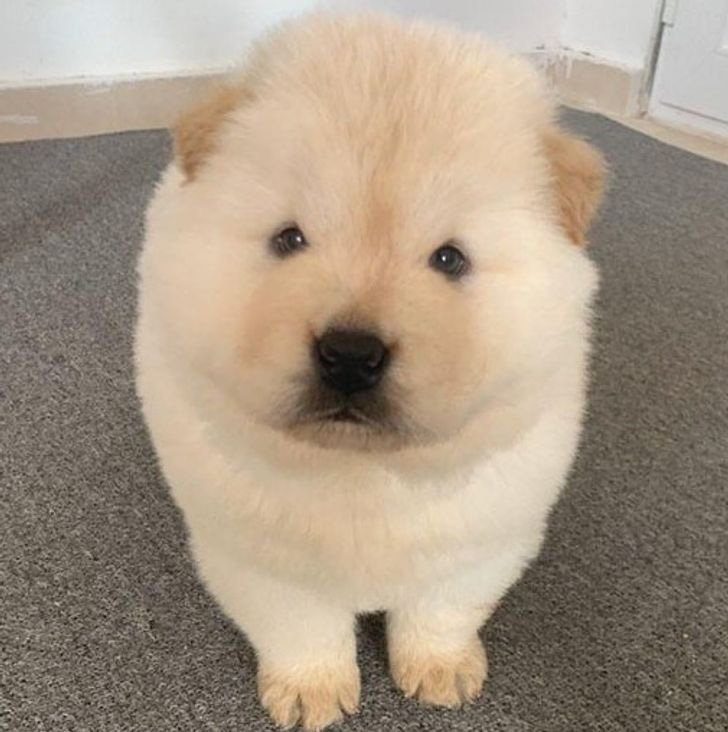
Identify the location of white door hinge. This screenshot has height=732, width=728. (672, 12).